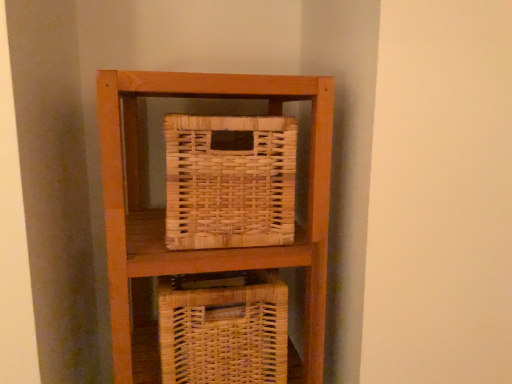
In order to face natural wicker picnic basket at center, should I rotate leftwards or rightwards?

You should look left and rotate roughly 4.623 degrees.

This screenshot has width=512, height=384. What do you see at coordinates (229, 182) in the screenshot?
I see `natural wicker picnic basket at center` at bounding box center [229, 182].

Measure the distance between natural wicker picnic basket at center and camera.

natural wicker picnic basket at center is 68.75 centimeters away from camera.

Image resolution: width=512 pixels, height=384 pixels. Find the location of `natural wicker picnic basket at center`. natural wicker picnic basket at center is located at coordinates [x=229, y=182].

What is the approximate width of woven natural basket at center?

woven natural basket at center is 10.19 inches in width.

What do you see at coordinates (224, 332) in the screenshot?
I see `woven natural basket at center` at bounding box center [224, 332].

What are the coordinates of `woven natural basket at center` in the screenshot? It's located at (224, 332).

Find the location of a particular element. natural wicker picnic basket at center is located at coordinates (229, 182).

Considering the relative positions of woven natural basket at center and natural wicker picnic basket at center in the image provided, is woven natural basket at center to the left or to the right of natural wicker picnic basket at center?

In the image, woven natural basket at center appears on the left side of natural wicker picnic basket at center.

Is woven natural basket at center in front of or behind natural wicker picnic basket at center in the image?

Visually, woven natural basket at center is located behind natural wicker picnic basket at center.

Considering the points (227, 307) and (238, 178), which point is in front, point (227, 307) or point (238, 178)?

Point (238, 178)

From the image's perspective, would you say woven natural basket at center is positioned over natural wicker picnic basket at center?

No, from the image's perspective, woven natural basket at center is not on top of natural wicker picnic basket at center.

From a real-world perspective, between woven natural basket at center and natural wicker picnic basket at center, who is vertically lower?

woven natural basket at center is physically lower.

Between woven natural basket at center and natural wicker picnic basket at center, which one has larger width?

woven natural basket at center.

Who is shorter, woven natural basket at center or natural wicker picnic basket at center?

Standing shorter between the two is natural wicker picnic basket at center.

Can you confirm if woven natural basket at center is smaller than natural wicker picnic basket at center?

No, woven natural basket at center is not smaller than natural wicker picnic basket at center.

Is woven natural basket at center inside or outside of natural wicker picnic basket at center?

woven natural basket at center cannot be found inside natural wicker picnic basket at center.

Is woven natural basket at center touching natural wicker picnic basket at center?

No, woven natural basket at center is not next to natural wicker picnic basket at center.

Could you tell me if woven natural basket at center is facing natural wicker picnic basket at center?

No, woven natural basket at center is not facing towards natural wicker picnic basket at center.

What's the angular difference between woven natural basket at center and natural wicker picnic basket at center's facing directions?

The facing directions of woven natural basket at center and natural wicker picnic basket at center are 0.966 degrees apart.

Locate an element on the screen. The image size is (512, 384). picnic basket above the woven natural basket at center (from the image's perspective) is located at coordinates (229, 182).

Is natural wicker picnic basket at center to the right of woven natural basket at center from the viewer's perspective?

Correct, you'll find natural wicker picnic basket at center to the right of woven natural basket at center.

Considering the positions of objects natural wicker picnic basket at center and woven natural basket at center in the image provided, who is behind, natural wicker picnic basket at center or woven natural basket at center?

woven natural basket at center.

Is point (253, 178) less distant than point (199, 339)?

Yes, point (253, 178) is in front of point (199, 339).

From the image's perspective, which one is positioned higher, natural wicker picnic basket at center or woven natural basket at center?

natural wicker picnic basket at center.

From a real-world perspective, between natural wicker picnic basket at center and woven natural basket at center, who is vertically lower?

woven natural basket at center is physically lower.

Does natural wicker picnic basket at center have a greater width compared to woven natural basket at center?

No, natural wicker picnic basket at center is not wider than woven natural basket at center.

Is natural wicker picnic basket at center shorter than woven natural basket at center?

Indeed, natural wicker picnic basket at center has a lesser height compared to woven natural basket at center.

Is natural wicker picnic basket at center bigger than woven natural basket at center?

No, natural wicker picnic basket at center is not bigger than woven natural basket at center.

Is woven natural basket at center a part of natural wicker picnic basket at center?

Definitely not — woven natural basket at center is not inside natural wicker picnic basket at center.

Is natural wicker picnic basket at center touching woven natural basket at center?

No.

Is natural wicker picnic basket at center oriented towards woven natural basket at center?

No, natural wicker picnic basket at center is not aimed at woven natural basket at center.

How many degrees apart are the facing directions of natural wicker picnic basket at center and woven natural basket at center?

The facing directions of natural wicker picnic basket at center and woven natural basket at center are 0.966 degrees apart.

How much distance is there between natural wicker picnic basket at center and woven natural basket at center?

natural wicker picnic basket at center is 6.85 inches away from woven natural basket at center.

The height and width of the screenshot is (384, 512). I want to click on basket lying behind the natural wicker picnic basket at center, so click(x=224, y=332).

In order to click on basket that appears below the natural wicker picnic basket at center (from a real-world perspective) in this screenshot , I will do pos(224,332).

The height and width of the screenshot is (384, 512). I want to click on picnic basket in front of the woven natural basket at center, so click(x=229, y=182).